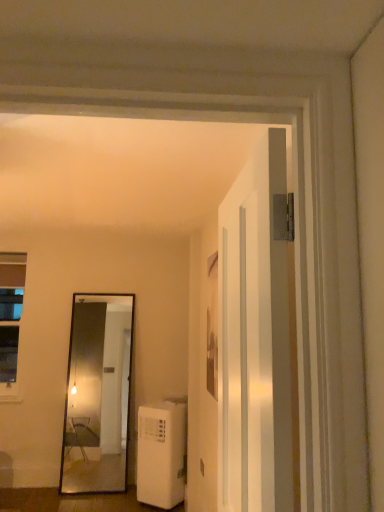
Identify the location of white plastic air conditioner at lower left. (162, 453).

What is the approximate width of white glossy door at center?

white glossy door at center is 17.17 centimeters in width.

I want to click on clear glass window at left, so click(10, 318).

Which object is further away from the camera taking this photo, clear glass window at left or white glossy door at center?

clear glass window at left is further away from the camera.

Is point (22, 290) less distant than point (254, 327)?

No, it is not.

Is clear glass window at left oriented away from white glossy door at center?

No, white glossy door at center is not at the back of clear glass window at left.

From a real-world perspective, is clear glass window at left under white glossy door at center?

Yes, from a real-world perspective, clear glass window at left is below white glossy door at center.

The image size is (384, 512). Identify the location of window on the left of the white plastic air conditioner at lower left. (10, 318).

Does point (4, 271) lie in front of point (142, 461)?

No, it is not.

How many degrees apart are the facing directions of clear glass window at left and white plastic air conditioner at lower left?

89.1 degrees separate the facing orientations of clear glass window at left and white plastic air conditioner at lower left.

Between clear glass window at left and white plastic air conditioner at lower left, which one has more height?

Standing taller between the two is clear glass window at left.

In the image, is white plastic air conditioner at lower left positioned in front of or behind white glossy door at center?

white plastic air conditioner at lower left is positioned farther from the viewer than white glossy door at center.

In the scene shown: From the image's perspective, is white plastic air conditioner at lower left over white glossy door at center?

No, from the image's perspective, white plastic air conditioner at lower left is not on top of white glossy door at center.

From their relative heights in the image, would you say white plastic air conditioner at lower left is taller or shorter than white glossy door at center?

Considering their sizes, white plastic air conditioner at lower left has less height than white glossy door at center.

Is white glossy door at center completely or partially inside white plastic air conditioner at lower left?

No, white glossy door at center is not inside white plastic air conditioner at lower left.

Who is smaller, white glossy door at center or clear glass window at left?

Smaller between the two is clear glass window at left.

Image resolution: width=384 pixels, height=512 pixels. In order to click on door above the clear glass window at left (from the image's perspective) in this screenshot , I will do `click(255, 336)`.

Considering the sizes of objects white glossy door at center and clear glass window at left in the image provided, who is thinner, white glossy door at center or clear glass window at left?

clear glass window at left is thinner.

Is there a large distance between white glossy door at center and clear glass window at left?

That's right, there is a large distance between white glossy door at center and clear glass window at left.

Is the surface of white plastic air conditioner at lower left in direct contact with clear glass window at left?

No, white plastic air conditioner at lower left is not in contact with clear glass window at left.

Is white plastic air conditioner at lower left turned away from clear glass window at left?

No, white plastic air conditioner at lower left's orientation is not away from clear glass window at left.

Can clear glass window at left be found inside white plastic air conditioner at lower left?

That's incorrect, clear glass window at left is not inside white plastic air conditioner at lower left.

Can you confirm if white plastic air conditioner at lower left is thinner than clear glass window at left?

Incorrect, the width of white plastic air conditioner at lower left is not less than that of clear glass window at left.

Would you say white glossy door at center is inside or outside white plastic air conditioner at lower left?

The correct answer is: outside.

From the image's perspective, which one is positioned lower, white glossy door at center or white plastic air conditioner at lower left?

white plastic air conditioner at lower left appears lower in the image.

Is white glossy door at center to the left of white plastic air conditioner at lower left from the viewer's perspective?

No.

Locate an element on the screen. This screenshot has height=512, width=384. door in front of the clear glass window at left is located at coordinates pyautogui.click(x=255, y=336).

In the image, there is a white plastic air conditioner at lower left. Identify the location of window above it (from the image's perspective). This screenshot has height=512, width=384. (10, 318).

From the image, which object appears to be farther from white plastic air conditioner at lower left, white glossy door at center or clear glass window at left?

Among the two, white glossy door at center is located further to white plastic air conditioner at lower left.

Considering their positions, is white plastic air conditioner at lower left positioned further to clear glass window at left than white glossy door at center?

white glossy door at center lies further to clear glass window at left than the other object.

From the image, which object appears to be nearer to white glossy door at center, white plastic air conditioner at lower left or clear glass window at left?

The object closer to white glossy door at center is white plastic air conditioner at lower left.

From the image, which object appears to be nearer to white glossy door at center, clear glass window at left or white plastic air conditioner at lower left?

Among the two, white plastic air conditioner at lower left is located nearer to white glossy door at center.

Which object lies further to the anchor point clear glass window at left, white glossy door at center or white plastic air conditioner at lower left?

white glossy door at center is further to clear glass window at left.

From the image, which object appears to be nearer to white plastic air conditioner at lower left, clear glass window at left or white glossy door at center?

clear glass window at left is positioned closer to the anchor white plastic air conditioner at lower left.

At what (x,y) coordinates should I click in order to perform the action: click on air conditioner between white glossy door at center and clear glass window at left from front to back. Please return your answer as a coordinate pair (x, y). Looking at the image, I should click on (162, 453).